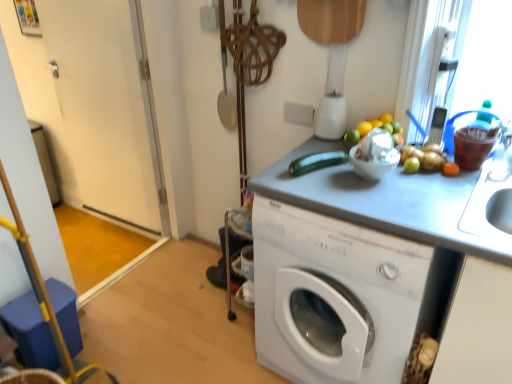
The width and height of the screenshot is (512, 384). I want to click on free spot in front of white glossy bowl at center, so click(x=384, y=204).